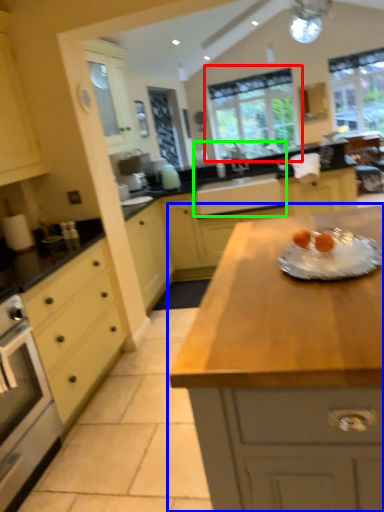
Question: Which object is the farthest from window (highlighted by a red box)? Choose among these: countertop (highlighted by a blue box) or sink (highlighted by a green box).

Choices:
 (A) countertop
 (B) sink

Answer: (A)